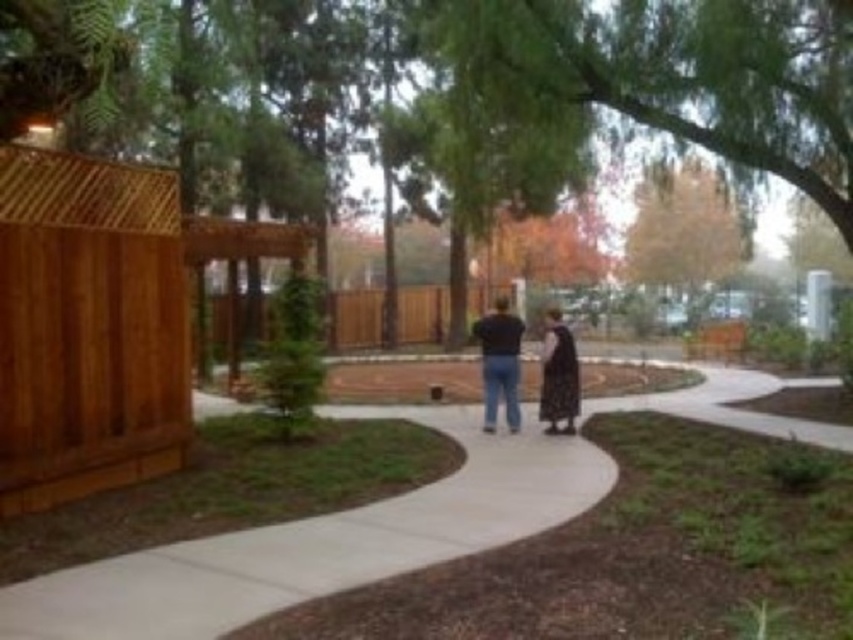
Question: Is smooth concrete pavement at center above dark gray fabric dress at center?

Choices:
 (A) yes
 (B) no

Answer: (B)

Question: Which point appears closest to the camera in this image?

Choices:
 (A) (549, 397)
 (B) (387, 410)

Answer: (A)

Question: Among these objects, which one is nearest to the camera?

Choices:
 (A) dark blue jeans at center
 (B) dark gray fabric dress at center

Answer: (B)

Question: Does dark gray sweater at center appear on the left side of dark blue jeans at center?

Choices:
 (A) no
 (B) yes

Answer: (A)

Question: Is dark blue jeans at center smaller than dark gray fabric dress at center?

Choices:
 (A) no
 (B) yes

Answer: (B)

Question: Which point is farther from the camera taking this photo?

Choices:
 (A) (489, 362)
 (B) (486, 316)

Answer: (B)